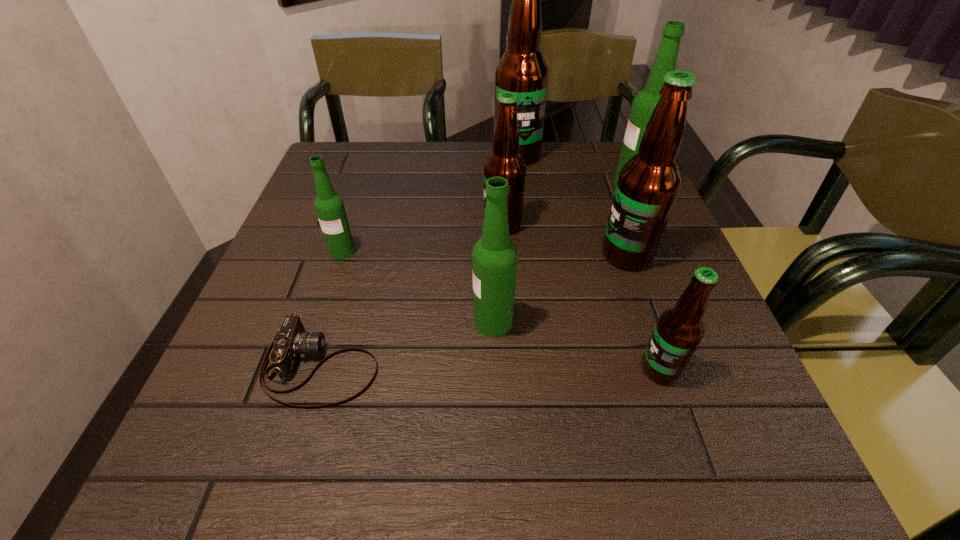
You are a GUI agent. You are given a task and a screenshot of the screen. Output one action in this format:
    pyautogui.click(x=<x>, y=<y>)
    Task: Click on the free space located on the label of the third farthest brown beer bottle
    The image size is (960, 540).
    Given the screenshot: What is the action you would take?
    [x=526, y=255]

Locate an element on the screen. Image resolution: width=960 pixels, height=540 pixels. free space located on the label of the third farthest brown beer bottle is located at coordinates (544, 255).

This screenshot has width=960, height=540. I want to click on free region located on the label of the third farthest beer bottle, so click(400, 225).

Image resolution: width=960 pixels, height=540 pixels. I want to click on vacant space positioned on the label of the third farthest beer bottle, so click(309, 225).

Where is `free point located on the label of the third farthest beer bottle`? This screenshot has height=540, width=960. free point located on the label of the third farthest beer bottle is located at coordinates (448, 225).

In order to click on free spot located on the label of the nearest green beer bottle in this screenshot , I will do `click(396, 322)`.

Identify the location of free space located on the label of the nearest green beer bottle. The height and width of the screenshot is (540, 960). (353, 322).

Locate an element on the screen. The height and width of the screenshot is (540, 960). free space located on the label of the nearest green beer bottle is located at coordinates [343, 322].

Where is `vacant position located on the label of the smallest brown beer bottle`? Image resolution: width=960 pixels, height=540 pixels. vacant position located on the label of the smallest brown beer bottle is located at coordinates (503, 369).

In order to click on vacant area situated on the label of the smallest brown beer bottle in this screenshot , I will do `click(449, 369)`.